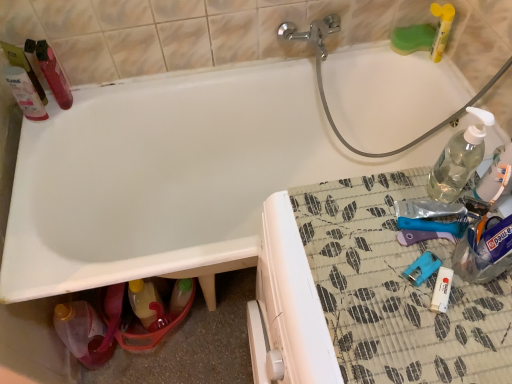
Question: Does translucent yellow bottle at lower left, which is the 3th bottle from right to left, contain clear plastic bottle at upper right, positioned as the 5th bottle in left-to-right order?

Choices:
 (A) no
 (B) yes

Answer: (A)

Question: From a real-world perspective, is translucent yellow bottle at lower left, the fourth bottle viewed from the top, on top of clear plastic bottle at upper right, the 3th bottle from the bottom?

Choices:
 (A) yes
 (B) no

Answer: (B)

Question: Is translucent yellow bottle at lower left, which is the 3th bottle from right to left, completely or partially outside of clear plastic bottle at upper right, positioned as the 5th bottle in left-to-right order?

Choices:
 (A) yes
 (B) no

Answer: (A)

Question: Does translucent yellow bottle at lower left, which is the 3th bottle from right to left, touch clear plastic bottle at upper right, which is counted as the third bottle, starting from the top?

Choices:
 (A) no
 (B) yes

Answer: (A)

Question: From a real-world perspective, does translucent yellow bottle at lower left, which is the 3th bottle from right to left, sit lower than clear plastic bottle at upper right, the 3th bottle from the bottom?

Choices:
 (A) no
 (B) yes

Answer: (B)

Question: Considering the relative sizes of translucent yellow bottle at lower left, the fourth bottle viewed from the top, and clear plastic bottle at upper right, which appears as the 1th bottle when viewed from the right, in the image provided, is translucent yellow bottle at lower left, the fourth bottle viewed from the top, shorter than clear plastic bottle at upper right, which appears as the 1th bottle when viewed from the right,?

Choices:
 (A) no
 (B) yes

Answer: (A)

Question: Does clear plastic bottle at upper right, positioned as the 5th bottle in left-to-right order, come behind translucent yellow bottle at lower left, the fourth bottle viewed from the top?

Choices:
 (A) no
 (B) yes

Answer: (A)

Question: Can you confirm if clear plastic bottle at upper right, positioned as the 5th bottle in left-to-right order, is shorter than translucent yellow bottle at lower left, which is the 3th bottle from right to left?

Choices:
 (A) yes
 (B) no

Answer: (A)

Question: Is clear plastic bottle at upper right, the 3th bottle from the bottom, at the left side of translucent yellow bottle at lower left, which is the 3th bottle from right to left?

Choices:
 (A) yes
 (B) no

Answer: (B)

Question: From the image's perspective, would you say clear plastic bottle at upper right, the 3th bottle from the bottom, is positioned over translucent yellow bottle at lower left, which is counted as the 2th bottle, starting from the bottom?

Choices:
 (A) yes
 (B) no

Answer: (A)

Question: Is clear plastic bottle at upper right, positioned as the 5th bottle in left-to-right order, oriented towards translucent yellow bottle at lower left, which is the third bottle from left to right?

Choices:
 (A) yes
 (B) no

Answer: (B)

Question: Can you confirm if clear plastic bottle at upper right, which is counted as the third bottle, starting from the top, is positioned to the right of translucent yellow bottle at lower left, which is counted as the 2th bottle, starting from the bottom?

Choices:
 (A) no
 (B) yes

Answer: (B)

Question: From the image's perspective, is translucent plastic bottle at upper left, which is the 5th bottle from right to left, over translucent yellow bottle at lower left, which is the third bottle from left to right?

Choices:
 (A) yes
 (B) no

Answer: (A)